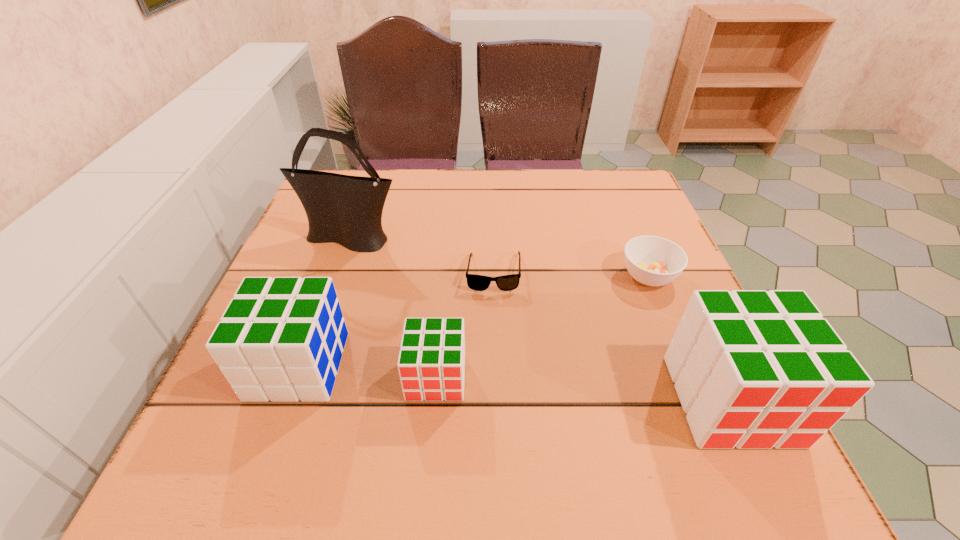
This screenshot has width=960, height=540. In order to click on vacant space at the left edge of the desktop in this screenshot , I will do `click(285, 276)`.

Locate an element on the screen. This screenshot has width=960, height=540. free location at the right edge of the desktop is located at coordinates 680,298.

Image resolution: width=960 pixels, height=540 pixels. I want to click on vacant space at the far right corner, so click(x=640, y=195).

The width and height of the screenshot is (960, 540). In order to click on free space that is in between the rightmost cube and the third tallest object in this screenshot , I will do `click(515, 383)`.

The height and width of the screenshot is (540, 960). What are the coordinates of `vacant area between the second tallest cube and the soup bowl` in the screenshot? It's located at (473, 321).

In order to click on vacant area that lies between the shortest cube and the rightmost cube in this screenshot , I will do `click(584, 388)`.

This screenshot has height=540, width=960. I want to click on unoccupied position between the soup bowl and the second tallest cube, so [473, 321].

What are the coordinates of `empty space that is in between the shortest object and the second cube from left to right` in the screenshot? It's located at (465, 325).

Where is `empty space between the soup bowl and the third shortest object`? empty space between the soup bowl and the third shortest object is located at coordinates (542, 326).

Find the location of a particular element. This screenshot has height=540, width=960. vacant region between the fourth tallest object and the fifth tallest object is located at coordinates (542, 326).